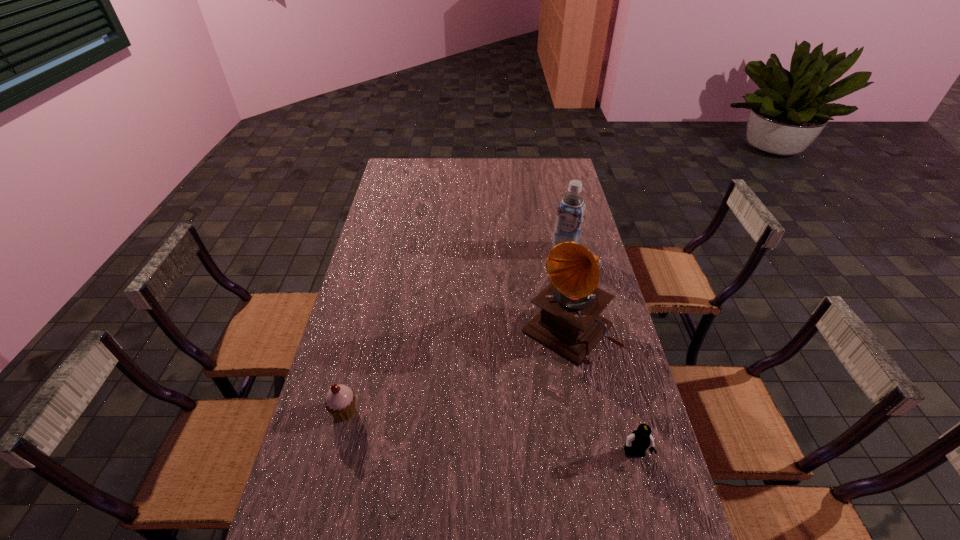
Identify the location of free space between the nearest object and the farthest object. This screenshot has width=960, height=540. (600, 353).

You are a GUI agent. You are given a task and a screenshot of the screen. Output one action in this format:
    pyautogui.click(x=<x>, y=<y>)
    Task: Click on the vacant area that lies between the Lego and the leftmost object
    This screenshot has height=540, width=960.
    Given the screenshot: What is the action you would take?
    pyautogui.click(x=490, y=433)

Locate an element on the screen. Image resolution: width=960 pixels, height=540 pixels. vacant space that is in between the nearest object and the second farthest object is located at coordinates (601, 392).

The height and width of the screenshot is (540, 960). I want to click on vacant space that is in between the nearest object and the second nearest object, so click(490, 433).

Where is `vacant region between the third nearest object and the Lego`? This screenshot has height=540, width=960. vacant region between the third nearest object and the Lego is located at coordinates (601, 392).

Identify the location of the closest object relative to the phonograph record. The image size is (960, 540). (570, 215).

Find the location of a particular element. object that is the closest to the leftmost object is located at coordinates (569, 322).

Locate an element on the screen. This screenshot has height=540, width=960. free spot that satisfies the following two spatial constraints: 1. on the back side of the tallest object; 2. on the right side of the second tallest object is located at coordinates (553, 251).